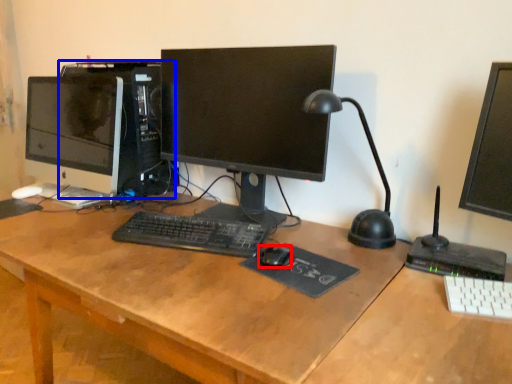
Question: Which of the following is the closest to the observer, mouse (highlighted by a red box) or computer tower (highlighted by a blue box)?

Choices:
 (A) mouse
 (B) computer tower

Answer: (A)